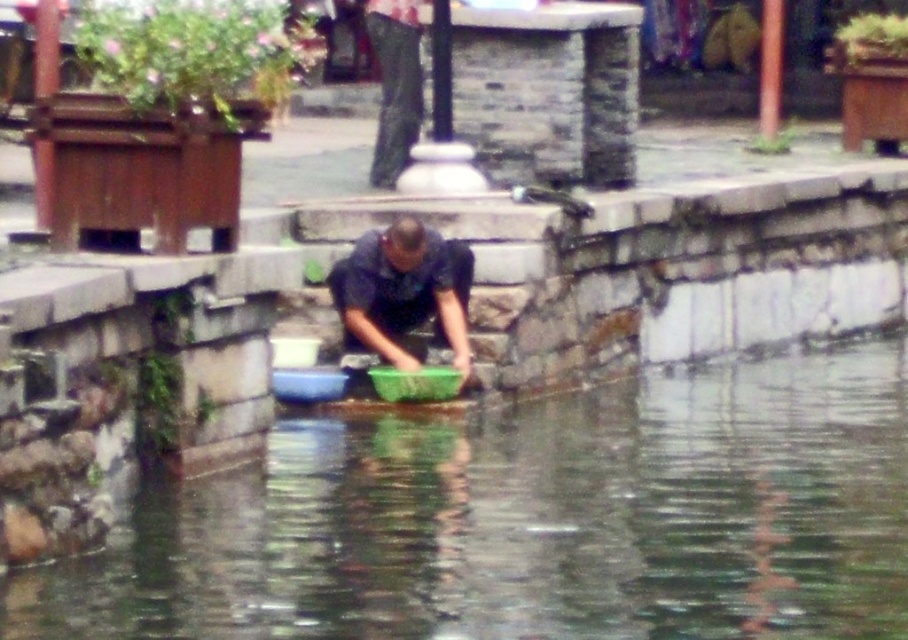
You are a photographer planning to capture the scene with a wide angle lens. You need to ensure that both the clear water at center and the dark blue shirt at center are fully visible in the frame. Based on their relative sizes, is there a risk that one of them might be cropped out?

The clear water at center might be wider than the dark blue shirt at center, so there is a risk that the dark blue shirt at center could be cropped out if the photographer doesn

You are a photographer trying to capture the scene with a wide angle lens. Given that the clear water at center and the dark blue shirt at center are both in your frame, which object will occupy more of the image area?

The clear water at center is bigger than the dark blue shirt at center, so it will occupy more of the image area.